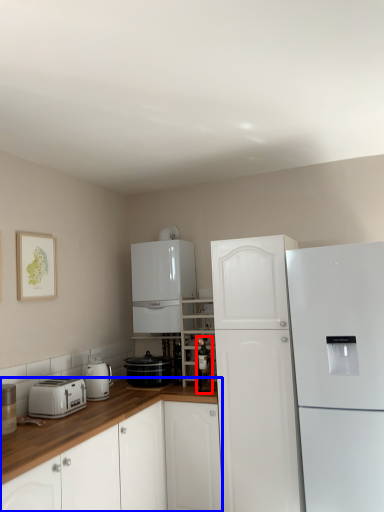
Question: Which object is further to the camera taking this photo, bottle (highlighted by a red box) or cabinetry (highlighted by a blue box)?

Choices:
 (A) bottle
 (B) cabinetry

Answer: (A)